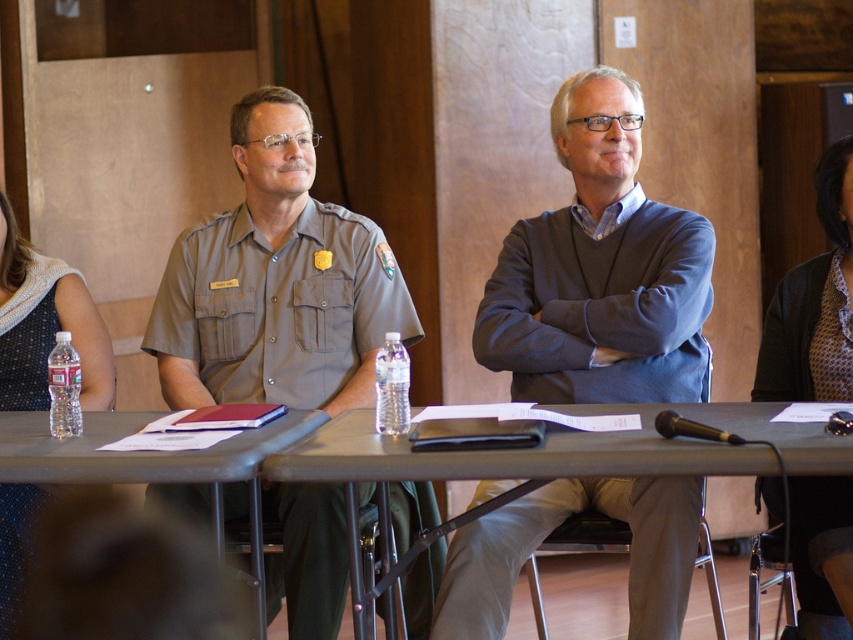
Does matte khaki uniform at center have a lesser width compared to metallic gray table at center?

Correct, matte khaki uniform at center's width is less than metallic gray table at center's.

Between matte khaki uniform at center and metallic gray table at center, which one has less height?

With less height is metallic gray table at center.

I want to click on matte khaki uniform at center, so click(x=276, y=282).

Where is `matte khaki uniform at center`? matte khaki uniform at center is located at coordinates (276, 282).

The height and width of the screenshot is (640, 853). Describe the element at coordinates (276, 282) in the screenshot. I see `matte khaki uniform at center` at that location.

Is matte khaki uniform at center positioned before clear plastic water bottle at left?

No, it is behind clear plastic water bottle at left.

Who is more distant from viewer, (270, 388) or (119, 456)?

Positioned behind is point (270, 388).

Find the location of `matte khaki uniform at center`. matte khaki uniform at center is located at coordinates (276, 282).

Does metallic gray table at center appear on the right side of clear plastic water bottle at left?

Indeed, metallic gray table at center is positioned on the right side of clear plastic water bottle at left.

Can you confirm if metallic gray table at center is thinner than clear plastic water bottle at left?

Incorrect, metallic gray table at center's width is not less than clear plastic water bottle at left's.

Between point (636, 540) and point (264, 433), which one is positioned in front?

Point (264, 433) is in front.

Where is `metallic gray table at center`? metallic gray table at center is located at coordinates (572, 449).